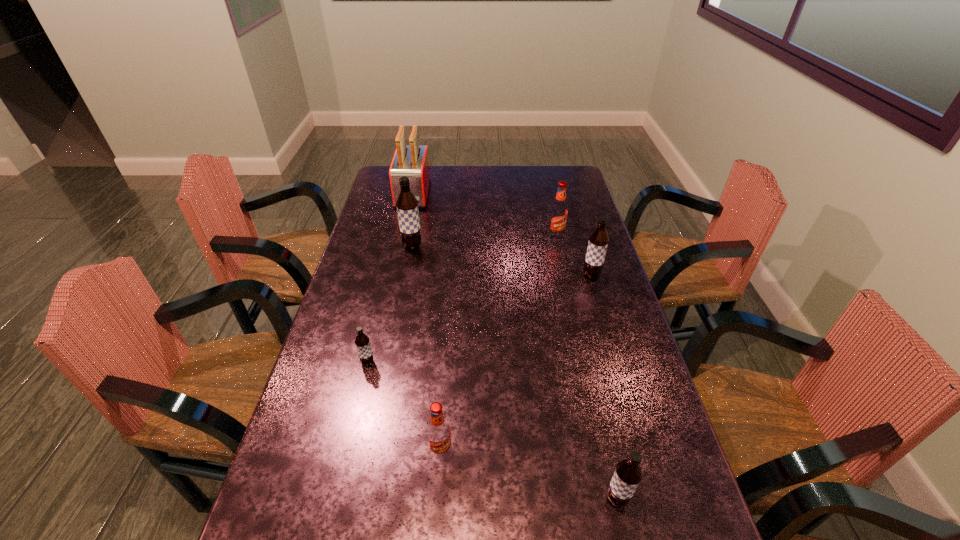
At what (x,y) coordinates should I click in order to perform the action: click on toaster. Please return your answer as a coordinate pair (x, y). This screenshot has height=540, width=960. Looking at the image, I should click on (412, 161).

Where is `red toaster`? The width and height of the screenshot is (960, 540). red toaster is located at coordinates (412, 161).

Find the location of a particular element. This screenshot has width=960, height=540. the fifth root beer from right to left is located at coordinates (407, 205).

You are a GUI agent. You are given a task and a screenshot of the screen. Output one action in this format:
    pyautogui.click(x=<x>, y=<y>)
    Task: Click on the second brown root beer from left to right
    The height and width of the screenshot is (540, 960).
    Given the screenshot: What is the action you would take?
    pyautogui.click(x=407, y=205)

The image size is (960, 540). In order to click on the bigger red root beer in this screenshot , I will do `click(558, 213)`.

This screenshot has height=540, width=960. I want to click on the farther red root beer, so click(x=558, y=213).

I want to click on the second biggest brown root beer, so click(x=598, y=242).

Where is `the rightmost brown root beer`? This screenshot has height=540, width=960. the rightmost brown root beer is located at coordinates (598, 242).

Find the location of a particular element. The image size is (960, 540). the fourth object from right to left is located at coordinates (439, 436).

Identify the location of the left red root beer. (439, 436).